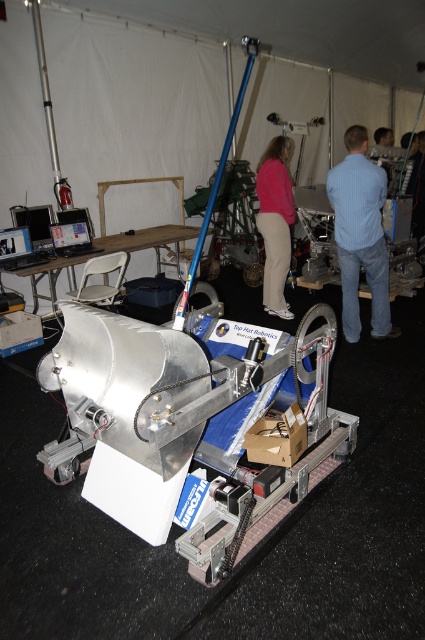
You are a fashion designer observing a display in a workshop. You notice a blue shirt at center and a matte pink sweater at center. How far apart are these two garments from each other?

The blue shirt at center and the matte pink sweater at center are 79.20 centimeters apart.

Looking at this image, you are organizing a clothing display in the workshop and need to arrange the blue shirt at center and the matte pink sweater at center. According to their positions, which item is on the right side?

The blue shirt at center is positioned on the right side of the matte pink sweater at center, so the blue shirt at center is on the right.